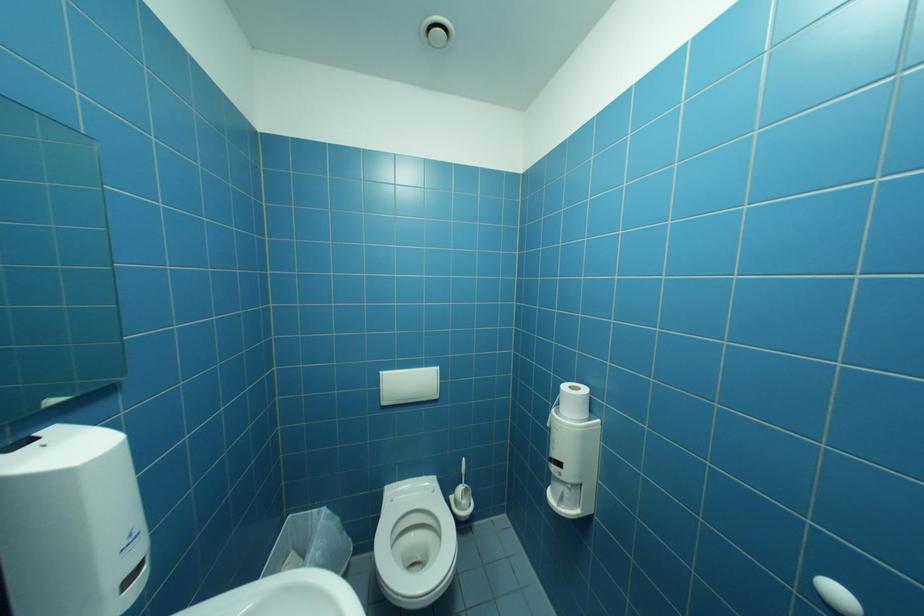
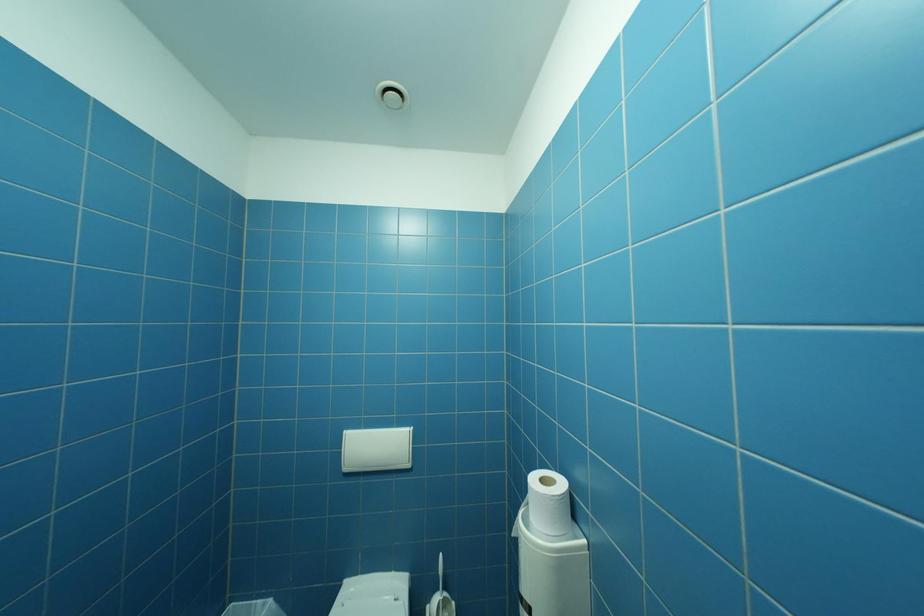
What movement of the cameraman would produce the second image?

The movement direction of the cameraman is right, forward.